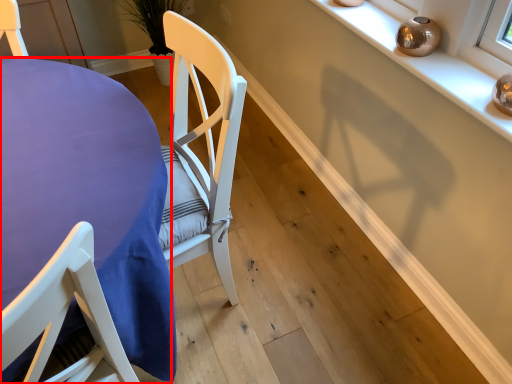
Question: From the image, what is the correct spatial relationship of table (annotated by the red box) in relation to shelf?

Choices:
 (A) right
 (B) left

Answer: (B)